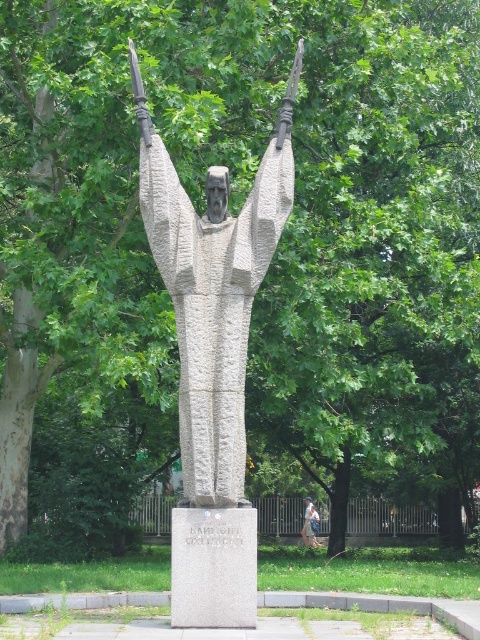
Is point (215, 486) closer to viewer compared to point (314, 540)?

Yes, point (215, 486) is closer to viewer.

Which of these two, gray stone statue at center or light blue denim jeans at center, stands taller?

With more height is gray stone statue at center.

Where is `gray stone statue at center`? This screenshot has width=480, height=640. gray stone statue at center is located at coordinates (213, 289).